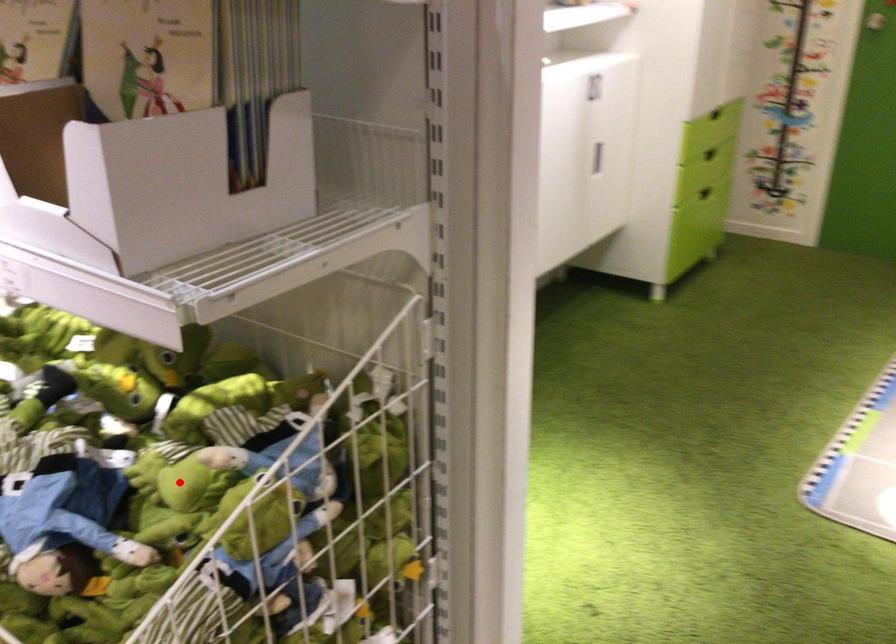
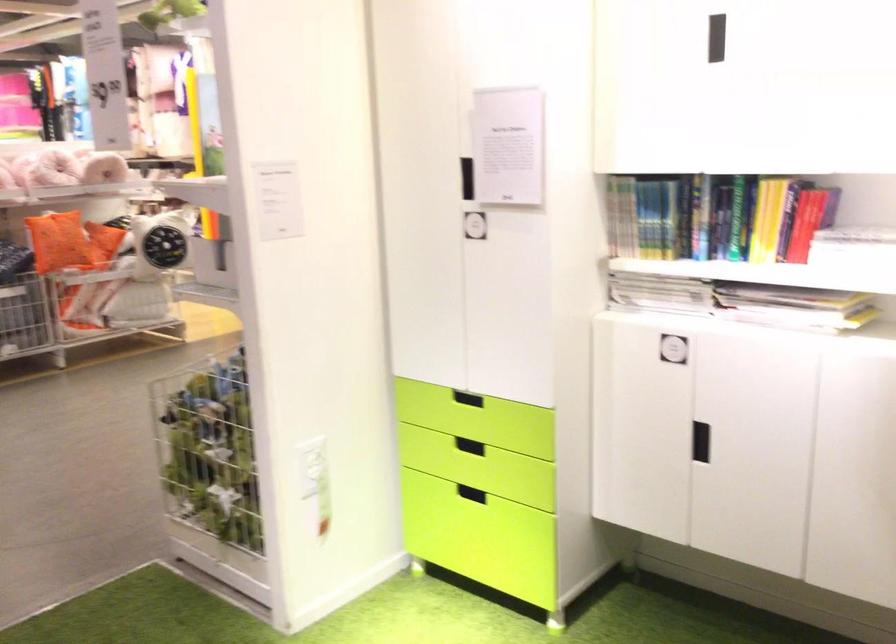
Question: I am providing you with two images of the same scene from different viewpoints. A red point is marked on the first image. Can you still see the location of the red point in image 2?

Choices:
 (A) Yes
 (B) No

Answer: (B)